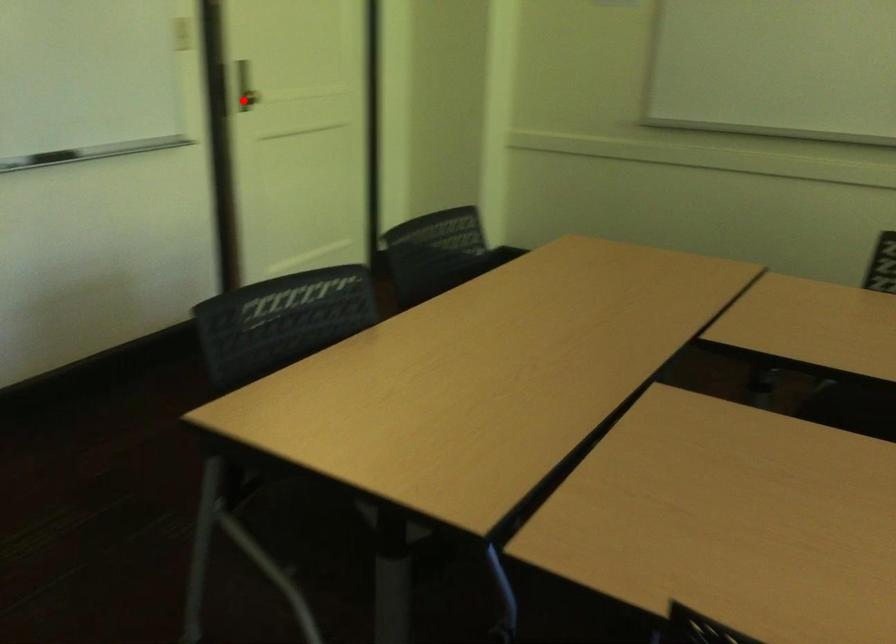
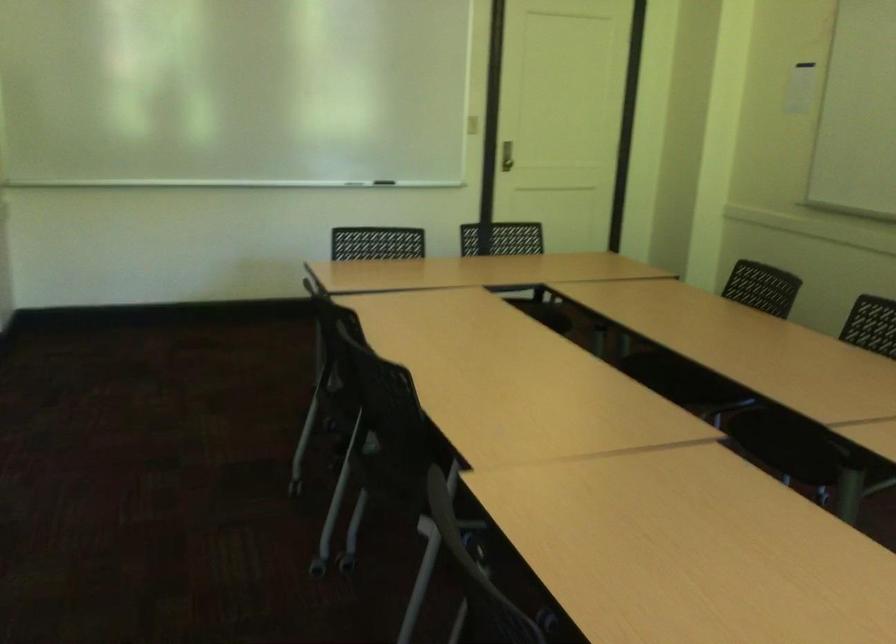
Question: I am providing you with two images of the same scene from different viewpoints. A red point is shown in image1. For the corresponding object point in image2, is it positioned nearer or farther from the camera?

Choices:
 (A) Nearer
 (B) Farther

Answer: (B)